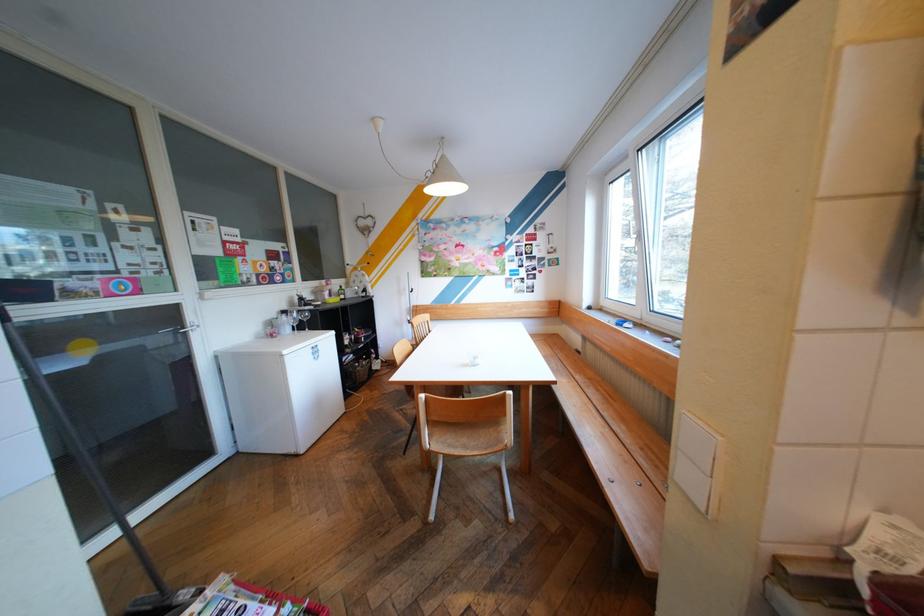
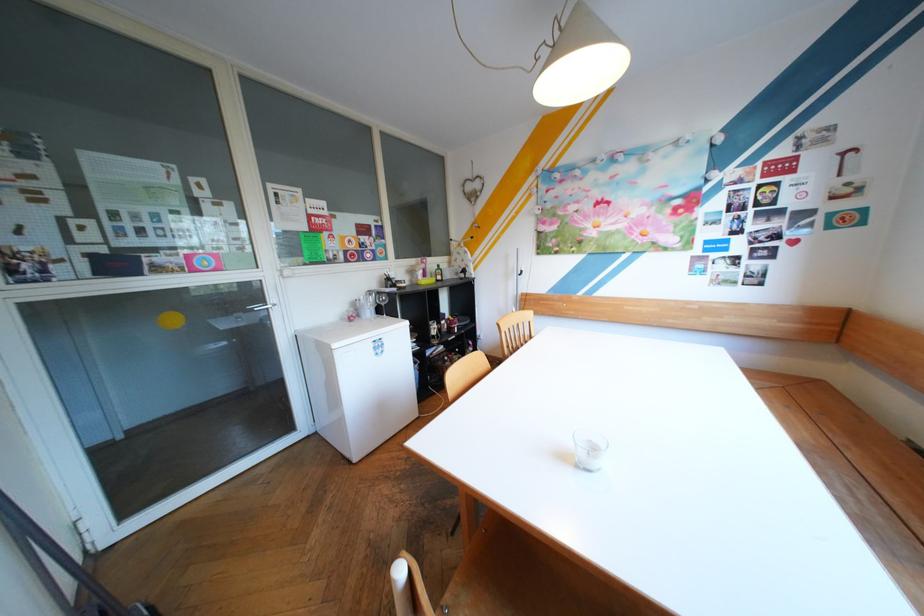
Find the pixel in the second image that matches point 341,291 in the first image.

(434, 270)